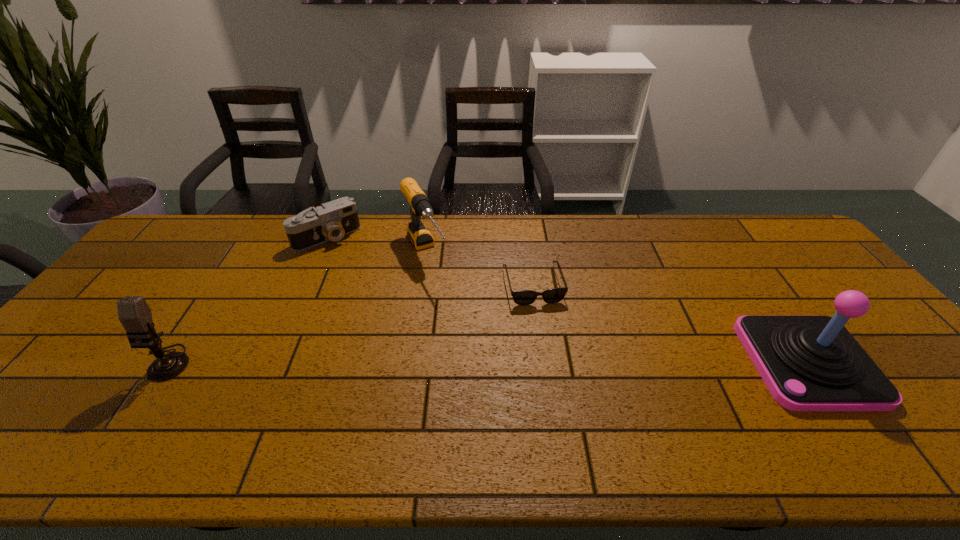
Find the location of a particular element. vacant space at the near right corner of the desktop is located at coordinates (921, 404).

The image size is (960, 540). I want to click on vacant space that's between the second object from right to left and the camera, so click(x=430, y=261).

Locate an element on the screen. vacant area that lies between the sunglasses and the joystick is located at coordinates (670, 323).

I want to click on vacant space that is in between the microphone and the second object from right to left, so click(x=349, y=323).

The height and width of the screenshot is (540, 960). What are the coordinates of `free space between the sunglasses and the rightmost object` in the screenshot? It's located at (670, 323).

This screenshot has height=540, width=960. Identify the location of blank region between the third object from right to left and the camera. (376, 245).

The width and height of the screenshot is (960, 540). Find the location of `vacant area that lies between the joystick and the shortest object`. vacant area that lies between the joystick and the shortest object is located at coordinates (670, 323).

Find the location of a particular element. This screenshot has width=960, height=540. vacant region between the sunglasses and the rightmost object is located at coordinates (670, 323).

Where is `free space between the fourth object from right to left and the joystick`? The image size is (960, 540). free space between the fourth object from right to left and the joystick is located at coordinates (567, 300).

Find the location of `empty space between the sunglasses and the microphone`. empty space between the sunglasses and the microphone is located at coordinates (349, 323).